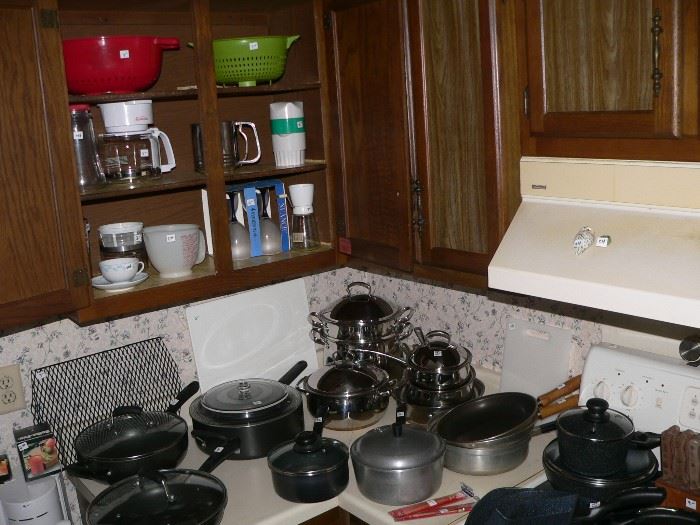
This screenshot has height=525, width=700. I want to click on backsplash, so click(x=475, y=306).